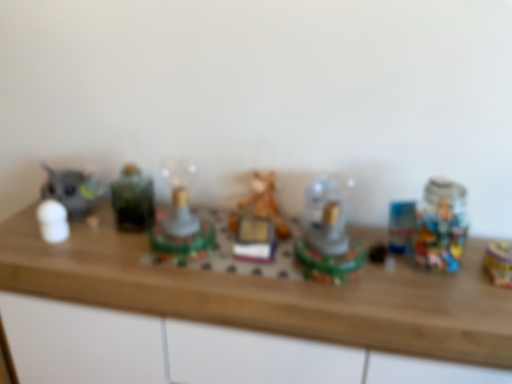
Find the location of a particular element. vacant space positioned to the left of white matte figurine at left, the first toy positioned from the left is located at coordinates (20, 235).